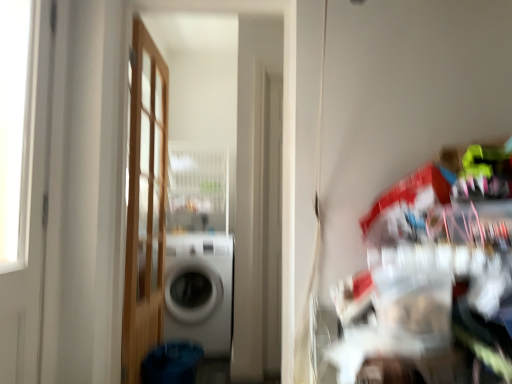
I want to click on wooden door at left, which is the first door from back to front, so click(x=145, y=203).

Which of these two, white glossy door at left, which is the first door from left to right, or wooden door at left, the 1th door from the right, is smaller?

white glossy door at left, which is the first door from left to right, is smaller.

Is white glossy door at left, the 2th door from the back, turned away from wooden door at left, which ranks as the 2th door in left-to-right order?

No.

Would you say white glossy door at left, placed as the second door when sorted from right to left, is outside wooden door at left, the 1th door from the right?

white glossy door at left, placed as the second door when sorted from right to left, is positioned outside wooden door at left, the 1th door from the right.

Considering the relative sizes of white glossy door at left, the 2th door from the back, and wooden door at left, which ranks as the 2th door in left-to-right order, in the image provided, is white glossy door at left, the 2th door from the back, taller than wooden door at left, which ranks as the 2th door in left-to-right order,?

No, white glossy door at left, the 2th door from the back, is not taller than wooden door at left, which ranks as the 2th door in left-to-right order.

From a real-world perspective, which is physically above, white glossy washing machine at center or white glossy door at left, marked as the first door in a front-to-back arrangement?

white glossy door at left, marked as the first door in a front-to-back arrangement, is physically above.

Could you measure the distance between white glossy washing machine at center and white glossy door at left, placed as the second door when sorted from right to left?

The distance of white glossy washing machine at center from white glossy door at left, placed as the second door when sorted from right to left, is 5.53 feet.

Between white glossy washing machine at center and white glossy door at left, marked as the first door in a front-to-back arrangement, which one has less height?

white glossy washing machine at center is shorter.

Considering their positions, is white glossy washing machine at center located in front of or behind white glossy door at left, which is the first door from left to right?

white glossy washing machine at center is behind white glossy door at left, which is the first door from left to right.

Which is nearer, [29,227] or [216,247]?

Point [29,227] is closer to the camera than point [216,247].

Looking at this image, can you confirm if white glossy door at left, which is the first door from left to right, is shorter than white glossy washing machine at center?

No, white glossy door at left, which is the first door from left to right, is not shorter than white glossy washing machine at center.

From a real-world perspective, who is located lower, white glossy door at left, marked as the first door in a front-to-back arrangement, or white glossy washing machine at center?

white glossy washing machine at center.

Is white glossy washing machine at center at the back of white glossy door at left, which is the first door from left to right?

white glossy door at left, which is the first door from left to right, does not have its back to white glossy washing machine at center.

How different are the orientations of wooden door at left, marked as the 2th door in a front-to-back arrangement, and white glossy washing machine at center in degrees?

89 degrees.

From the image's perspective, relative to white glossy washing machine at center, is wooden door at left, the 1th door from the right, above or below?

wooden door at left, the 1th door from the right, is above white glossy washing machine at center.

Can you confirm if wooden door at left, which is the first door from back to front, is positioned to the right of white glossy washing machine at center?

Incorrect, wooden door at left, which is the first door from back to front, is not on the right side of white glossy washing machine at center.

Which of these two, wooden door at left, which is the first door from back to front, or white glossy washing machine at center, is bigger?

white glossy washing machine at center is bigger.

Is white glossy washing machine at center positioned in front of wooden door at left, which ranks as the 2th door in left-to-right order?

A: That is False.

Is white glossy washing machine at center aimed at wooden door at left, marked as the 2th door in a front-to-back arrangement?

Yes, white glossy washing machine at center is facing wooden door at left, marked as the 2th door in a front-to-back arrangement.

From the image's perspective, is white glossy washing machine at center on top of wooden door at left, marked as the 2th door in a front-to-back arrangement?

No, from the image's perspective, white glossy washing machine at center is not above wooden door at left, marked as the 2th door in a front-to-back arrangement.

Is white glossy washing machine at center inside the boundaries of wooden door at left, which ranks as the 2th door in left-to-right order, or outside?

white glossy washing machine at center exists outside the volume of wooden door at left, which ranks as the 2th door in left-to-right order.

Considering the relative positions of wooden door at left, which ranks as the 2th door in left-to-right order, and white glossy door at left, placed as the second door when sorted from right to left, in the image provided, is wooden door at left, which ranks as the 2th door in left-to-right order, to the left or to the right of white glossy door at left, placed as the second door when sorted from right to left,?

wooden door at left, which ranks as the 2th door in left-to-right order, is to the right of white glossy door at left, placed as the second door when sorted from right to left.

Consider the image. Is wooden door at left, which ranks as the 2th door in left-to-right order, far away from white glossy door at left, marked as the first door in a front-to-back arrangement?

That's not correct — wooden door at left, which ranks as the 2th door in left-to-right order, is a little close to white glossy door at left, marked as the first door in a front-to-back arrangement.

Consider the image. From the image's perspective, is wooden door at left, the 1th door from the right, on white glossy door at left, the 2th door from the back?

No, from the image's perspective, wooden door at left, the 1th door from the right, is not on top of white glossy door at left, the 2th door from the back.

How many degrees apart are the facing directions of wooden door at left, marked as the 2th door in a front-to-back arrangement, and white glossy door at left, placed as the second door when sorted from right to left?

0.862 degrees separate the facing orientations of wooden door at left, marked as the 2th door in a front-to-back arrangement, and white glossy door at left, placed as the second door when sorted from right to left.

The image size is (512, 384). Find the location of `door that is on the left side of wooden door at left, marked as the 2th door in a front-to-back arrangement`. door that is on the left side of wooden door at left, marked as the 2th door in a front-to-back arrangement is located at coordinates (23, 180).

The height and width of the screenshot is (384, 512). Identify the location of door that is the 2nd one when counting forward from the white glossy washing machine at center. (23, 180).

Looking at the image, which one is located further to white glossy washing machine at center, white glossy door at left, which is the first door from left to right, or wooden door at left, which is the first door from back to front?

white glossy door at left, which is the first door from left to right.

From the image, which object appears to be nearer to white glossy washing machine at center, wooden door at left, which ranks as the 2th door in left-to-right order, or white glossy door at left, which is the first door from left to right?

The object closer to white glossy washing machine at center is wooden door at left, which ranks as the 2th door in left-to-right order.

Which object lies further to the anchor point wooden door at left, which ranks as the 2th door in left-to-right order, white glossy washing machine at center or white glossy door at left, placed as the second door when sorted from right to left?

white glossy door at left, placed as the second door when sorted from right to left, lies further to wooden door at left, which ranks as the 2th door in left-to-right order, than the other object.

Considering their positions, is white glossy door at left, the 2th door from the back, positioned closer to wooden door at left, which ranks as the 2th door in left-to-right order, than white glossy washing machine at center?

white glossy washing machine at center is positioned closer to the anchor wooden door at left, which ranks as the 2th door in left-to-right order.

Based on their spatial positions, is wooden door at left, marked as the 2th door in a front-to-back arrangement, or white glossy washing machine at center closer to white glossy door at left, the 2th door from the back?

Among the two, wooden door at left, marked as the 2th door in a front-to-back arrangement, is located nearer to white glossy door at left, the 2th door from the back.

Based on their spatial positions, is white glossy washing machine at center or wooden door at left, which is the first door from back to front, further from white glossy door at left, which is the first door from left to right?

Among the two, white glossy washing machine at center is located further to white glossy door at left, which is the first door from left to right.

The height and width of the screenshot is (384, 512). I want to click on door positioned between white glossy door at left, which is the first door from left to right, and white glossy washing machine at center from near to far, so click(x=145, y=203).